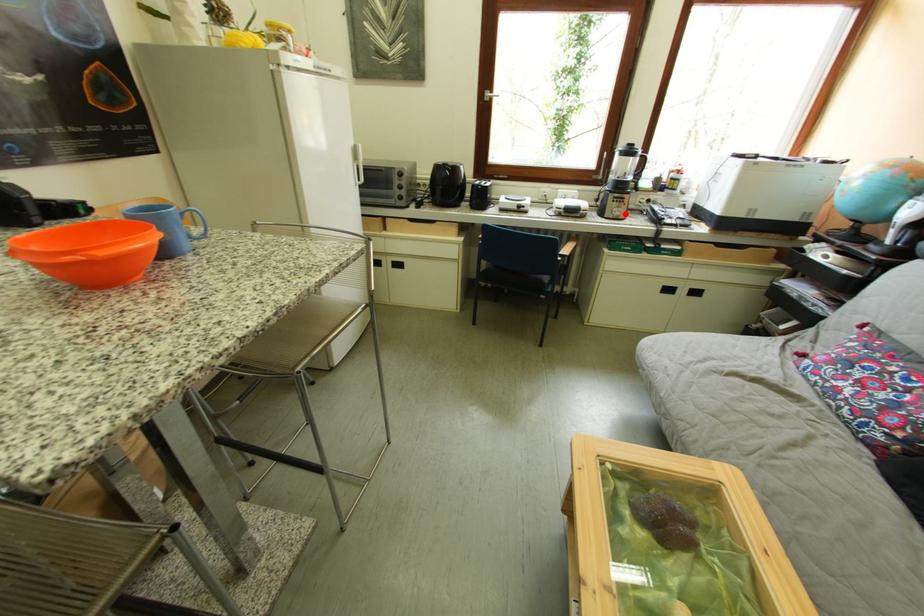
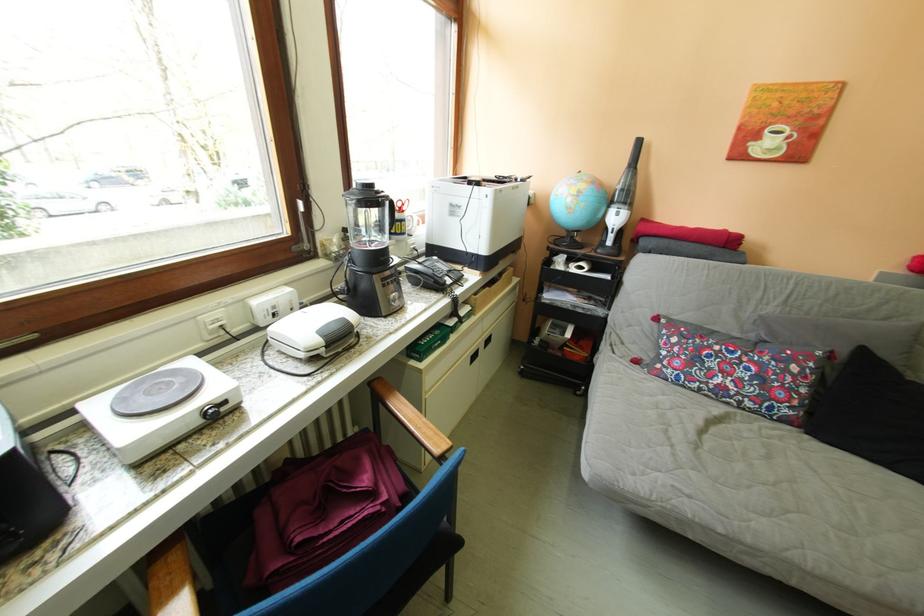
Question: I am providing you with two images of the same scene from different viewpoints. Given a red point in image1, look at the same physical point in image2. Is it:

Choices:
 (A) Closer to the viewpoint
 (B) Farther from the viewpoint

Answer: (A)